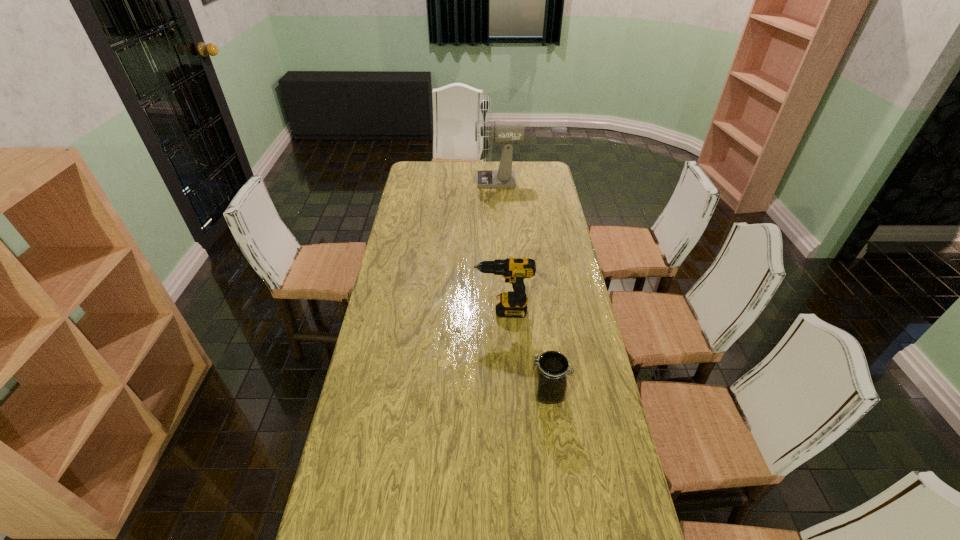
Identify the location of free location at the far right corner. The image size is (960, 540). (540, 161).

This screenshot has height=540, width=960. What are the coordinates of `empty location between the farthest object and the second farthest object` in the screenshot? It's located at (500, 246).

Where is `free space between the fan and the second nearest object`? This screenshot has height=540, width=960. free space between the fan and the second nearest object is located at coordinates (500, 246).

Find the location of `free space between the tallest object and the second nearest object`. free space between the tallest object and the second nearest object is located at coordinates [500, 246].

At what (x,y) coordinates should I click in order to perform the action: click on free spot between the fan and the second farthest object. Please return your answer as a coordinate pair (x, y). This screenshot has height=540, width=960. Looking at the image, I should click on (500, 246).

Where is `free area in between the drill and the fan`? The height and width of the screenshot is (540, 960). free area in between the drill and the fan is located at coordinates (500, 246).

Locate which object is the second closest to the fan. Please provide its 2D coordinates. Your answer should be formatted as a tuple, i.e. [(x, y)], where the tuple contains the x and y coordinates of a point satisfying the conditions above.

[(550, 382)]

Identify which object is the second nearest to the second tallest object. Please provide its 2D coordinates. Your answer should be formatted as a tuple, i.e. [(x, y)], where the tuple contains the x and y coordinates of a point satisfying the conditions above.

[(501, 131)]